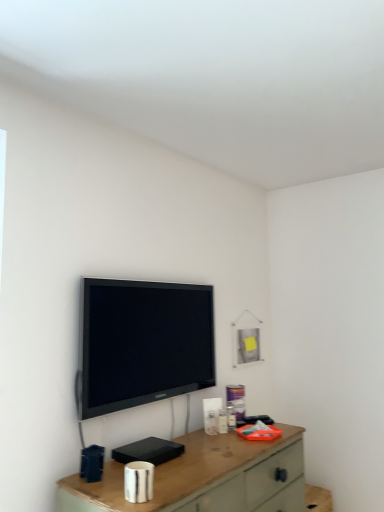
Question: Can you confirm if black glossy tv at upper center is smaller than wooden desk at center?

Choices:
 (A) yes
 (B) no

Answer: (A)

Question: From the image's perspective, is black glossy tv at upper center located beneath wooden desk at center?

Choices:
 (A) yes
 (B) no

Answer: (B)

Question: Does black glossy tv at upper center have a larger size compared to wooden desk at center?

Choices:
 (A) yes
 (B) no

Answer: (B)

Question: Considering the relative sizes of black glossy tv at upper center and wooden desk at center in the image provided, is black glossy tv at upper center taller than wooden desk at center?

Choices:
 (A) yes
 (B) no

Answer: (A)

Question: Considering the relative sizes of black glossy tv at upper center and wooden desk at center in the image provided, is black glossy tv at upper center shorter than wooden desk at center?

Choices:
 (A) no
 (B) yes

Answer: (A)

Question: Does black glossy tv at upper center come in front of wooden desk at center?

Choices:
 (A) yes
 (B) no

Answer: (B)

Question: Does wooden desk at center have a greater width compared to black glossy tv at upper center?

Choices:
 (A) no
 (B) yes

Answer: (B)

Question: Is wooden desk at center not within black glossy tv at upper center?

Choices:
 (A) no
 (B) yes

Answer: (B)

Question: From the image's perspective, would you say wooden desk at center is positioned over black glossy tv at upper center?

Choices:
 (A) yes
 (B) no

Answer: (B)

Question: Is wooden desk at center positioned far away from black glossy tv at upper center?

Choices:
 (A) no
 (B) yes

Answer: (A)

Question: Considering the relative sizes of wooden desk at center and black glossy tv at upper center in the image provided, is wooden desk at center bigger than black glossy tv at upper center?

Choices:
 (A) yes
 (B) no

Answer: (A)

Question: Does wooden desk at center have a lesser width compared to black glossy tv at upper center?

Choices:
 (A) yes
 (B) no

Answer: (B)

Question: From a real-world perspective, is wooden desk at center physically located above or below black glossy tv at upper center?

Choices:
 (A) above
 (B) below

Answer: (B)